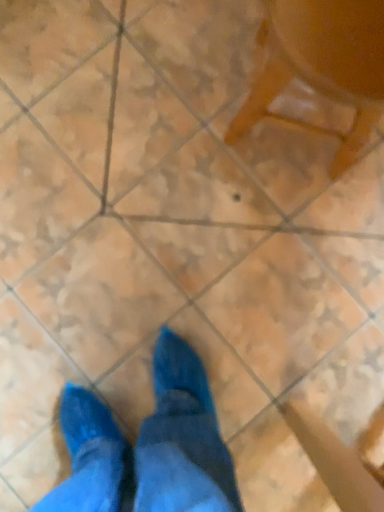
In order to face transparent plastic stool at upper right, should I rotate leftwards or rightwards?

Rotate right and turn 16.167 degrees.

Measure the distance between transparent plastic stool at upper right and camera.

A distance of 23.19 inches exists between transparent plastic stool at upper right and camera.

This screenshot has width=384, height=512. Describe the element at coordinates (322, 65) in the screenshot. I see `transparent plastic stool at upper right` at that location.

Image resolution: width=384 pixels, height=512 pixels. I want to click on transparent plastic stool at upper right, so click(322, 65).

At what (x,y) coordinates should I click in order to perform the action: click on transparent plastic stool at upper right. Please return your answer as a coordinate pair (x, y). This screenshot has width=384, height=512. Looking at the image, I should click on (322, 65).